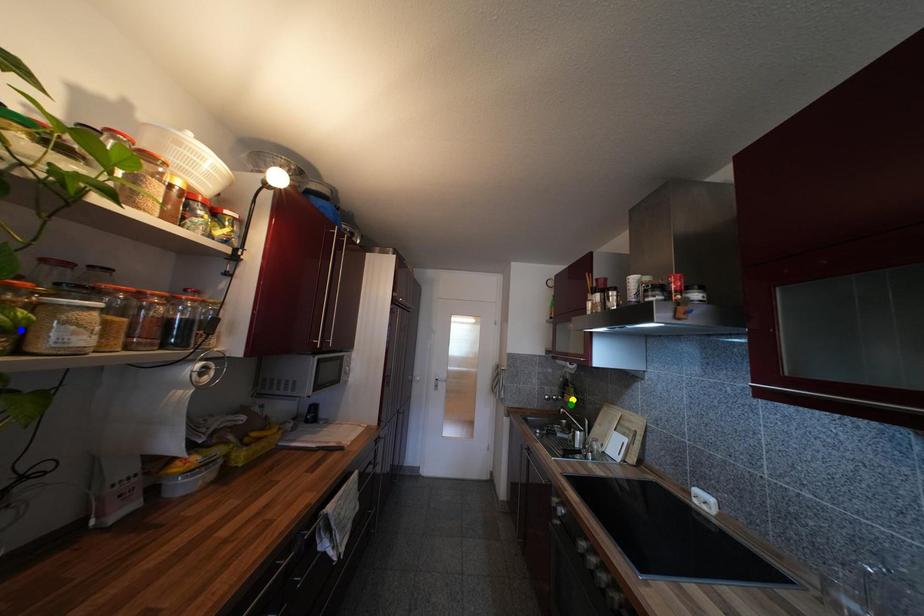
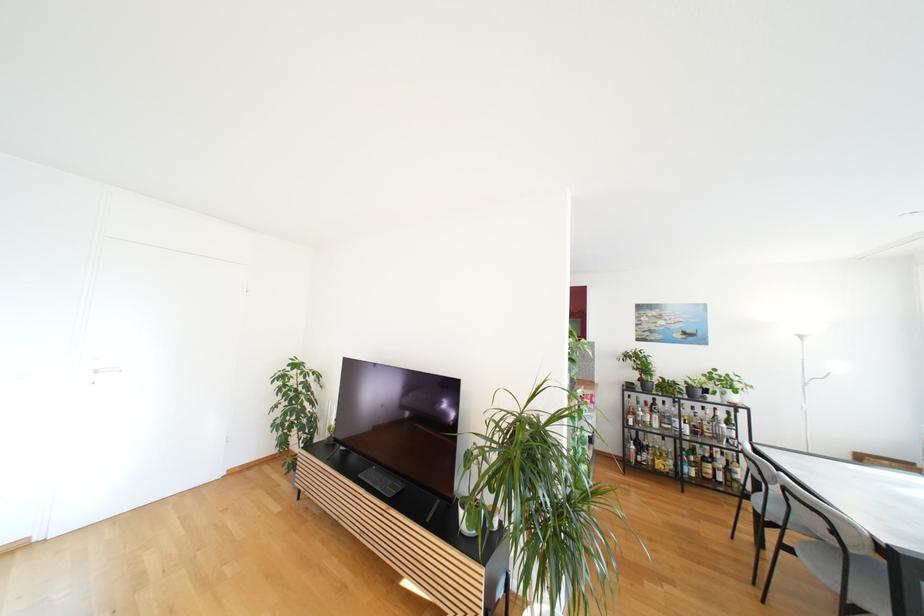
I am providing you with two images of the same scene from different viewpoints. Three points are marked in image1. Which point corresponds to a part or object that is occluded in image2?In image1, three points are marked. Which of them correspond to a part or object that is occluded in image2?Among the three points shown in image1, which one corresponds to a part or object that is no longer visible due to occlusion in image2?

Invisible in image2: yellow point, blue point, green point.